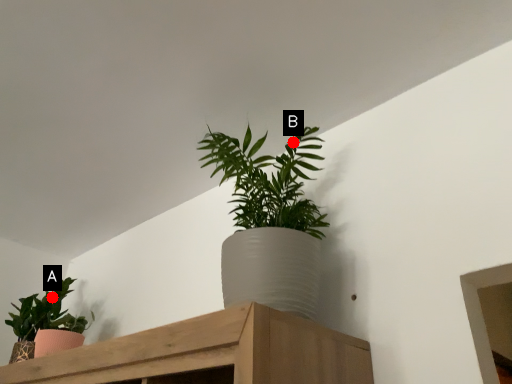
Question: Two points are circled on the image, labeled by A and B beside each circle. Which point is farther to the camera?

Choices:
 (A) A is further
 (B) B is further

Answer: (A)